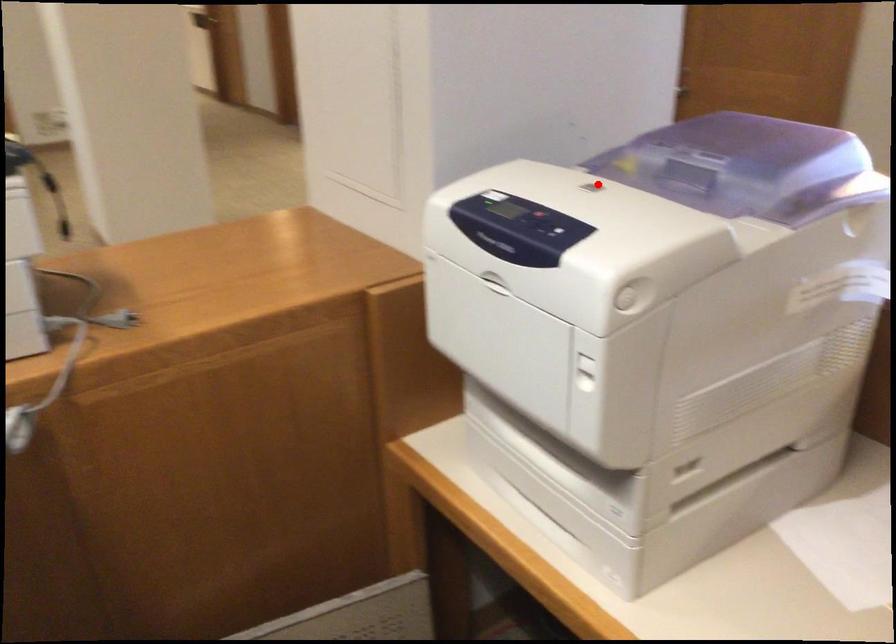
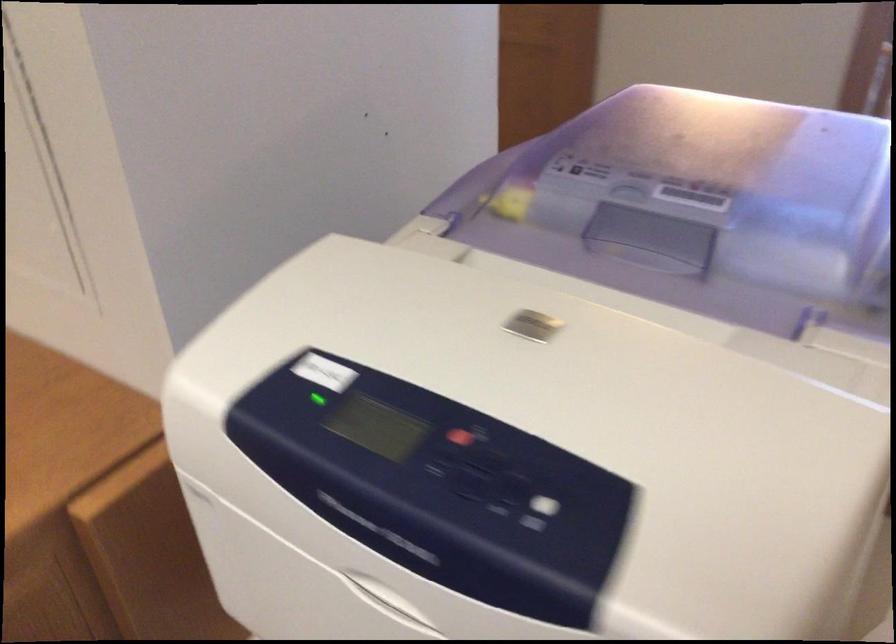
Question: I am providing you with two images of the same scene from different viewpoints. In image1, a red point is highlighted. Considering the same 3D point in image2, which of the following is correct?

Choices:
 (A) It is closer
 (B) It is farther

Answer: (A)